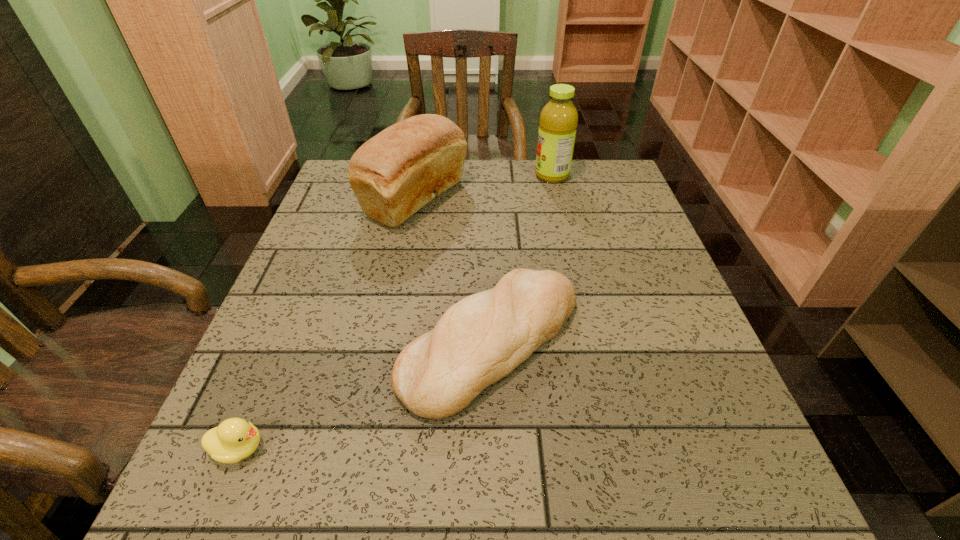
The height and width of the screenshot is (540, 960). What are the coordinates of `the tallest object` in the screenshot? It's located at (558, 121).

Locate an element on the screen. The image size is (960, 540). the taller bread is located at coordinates (394, 174).

Identify the location of the farther bread. (394, 174).

Where is `the second shortest object`? The width and height of the screenshot is (960, 540). the second shortest object is located at coordinates (479, 340).

The image size is (960, 540). In order to click on the third farthest object in this screenshot , I will do `click(479, 340)`.

Where is `the nearest object`? The height and width of the screenshot is (540, 960). the nearest object is located at coordinates (235, 439).

Identify the location of the leftmost object. The image size is (960, 540). (235, 439).

This screenshot has width=960, height=540. I want to click on vacant space located on the front label of the tallest object, so click(x=401, y=176).

Where is `free space located 0.150m on the front label of the tallest object`? free space located 0.150m on the front label of the tallest object is located at coordinates pyautogui.click(x=482, y=176).

Where is `free space located on the front label of the tallest object`? The image size is (960, 540). free space located on the front label of the tallest object is located at coordinates (422, 176).